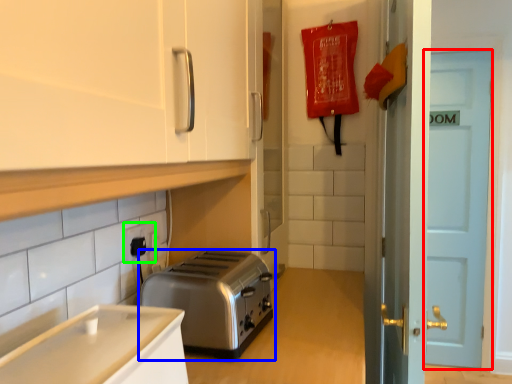
Question: Estimate the real-world distances between objects in this image. Which object is closer to door (highlighted by a red box), toaster (highlighted by a blue box) or electric outlet (highlighted by a green box)?

Choices:
 (A) toaster
 (B) electric outlet

Answer: (A)